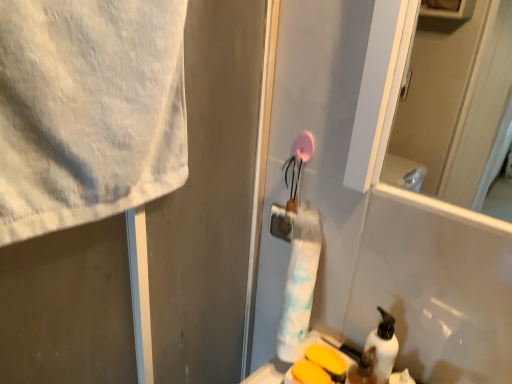
Question: From the image's perspective, is white matte pump bottle at lower right on top of translucent plastic soap dispenser at lower right?

Choices:
 (A) yes
 (B) no

Answer: (A)

Question: Could translucent plastic soap dispenser at lower right be considered to be inside white matte pump bottle at lower right?

Choices:
 (A) yes
 (B) no

Answer: (B)

Question: Does white matte pump bottle at lower right appear on the left side of translucent plastic soap dispenser at lower right?

Choices:
 (A) no
 (B) yes

Answer: (A)

Question: From a real-world perspective, is white matte pump bottle at lower right below translucent plastic soap dispenser at lower right?

Choices:
 (A) yes
 (B) no

Answer: (B)

Question: Can we say white matte pump bottle at lower right lies outside translucent plastic soap dispenser at lower right?

Choices:
 (A) yes
 (B) no

Answer: (A)

Question: Is white matte pump bottle at lower right facing towards translucent plastic soap dispenser at lower right?

Choices:
 (A) yes
 (B) no

Answer: (A)

Question: Is white matte towel at upper left wider than translucent plastic soap dispenser at lower right?

Choices:
 (A) yes
 (B) no

Answer: (A)

Question: Does white matte towel at upper left have a smaller size compared to translucent plastic soap dispenser at lower right?

Choices:
 (A) no
 (B) yes

Answer: (A)

Question: Can you confirm if white matte towel at upper left is shorter than translucent plastic soap dispenser at lower right?

Choices:
 (A) no
 (B) yes

Answer: (A)

Question: Considering the relative positions of white matte towel at upper left and translucent plastic soap dispenser at lower right in the image provided, is white matte towel at upper left behind translucent plastic soap dispenser at lower right?

Choices:
 (A) yes
 (B) no

Answer: (B)

Question: Is white matte towel at upper left bigger than translucent plastic soap dispenser at lower right?

Choices:
 (A) yes
 (B) no

Answer: (A)

Question: From the image's perspective, would you say white matte towel at upper left is positioned over translucent plastic soap dispenser at lower right?

Choices:
 (A) no
 (B) yes

Answer: (B)

Question: Can you confirm if yellow matte soap at lower center is taller than white matte towel at upper left?

Choices:
 (A) no
 (B) yes

Answer: (A)